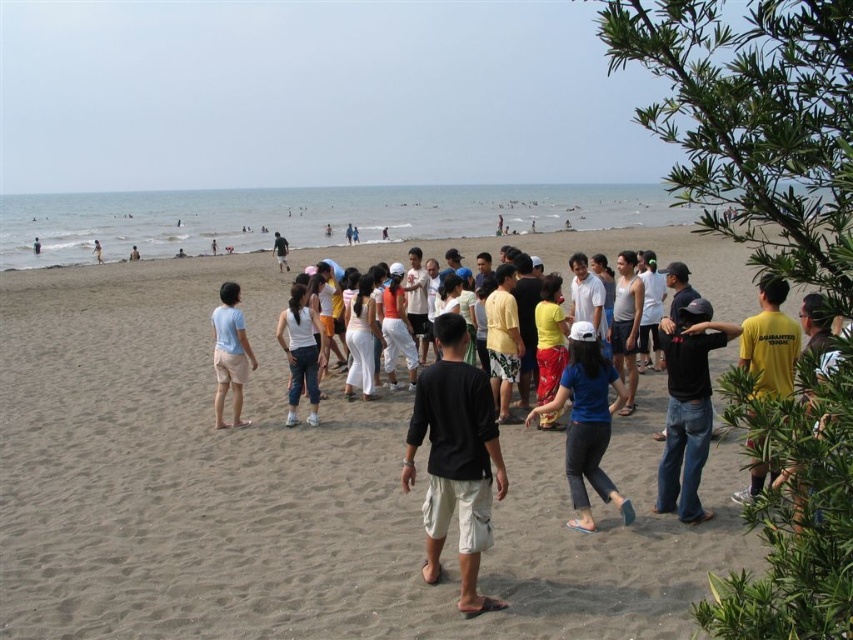
Between white cotton shirt at center and matte black shirt at center, which one appears on the left side from the viewer's perspective?

matte black shirt at center is more to the left.

Can you confirm if white cotton shirt at center is taller than matte black shirt at center?

In fact, white cotton shirt at center may be shorter than matte black shirt at center.

Which is behind, point (310, 332) or point (282, 262)?

The point (282, 262) is more distant.

Image resolution: width=853 pixels, height=640 pixels. I want to click on white cotton shirt at center, so click(300, 353).

Does blue fabric shirt at center have a lesser width compared to matte black shirt at center?

Indeed, blue fabric shirt at center has a lesser width compared to matte black shirt at center.

Which of these two, blue fabric shirt at center or matte black shirt at center, stands taller?

With more height is matte black shirt at center.

Between point (576, 528) and point (285, 244), which one is positioned behind?

Point (285, 244)

I want to click on blue fabric shirt at center, so click(x=587, y=422).

Can you confirm if yellow t-shirt at center-right is positioned to the left of light blue jeans at center?

In fact, yellow t-shirt at center-right is to the right of light blue jeans at center.

Who is lower down, yellow t-shirt at center-right or light blue jeans at center?

yellow t-shirt at center-right is lower down.

Is point (764, 477) positioned in front of point (100, 253)?

Yes, it is in front of point (100, 253).

Identify the location of yellow t-shirt at center-right. coord(770,340).